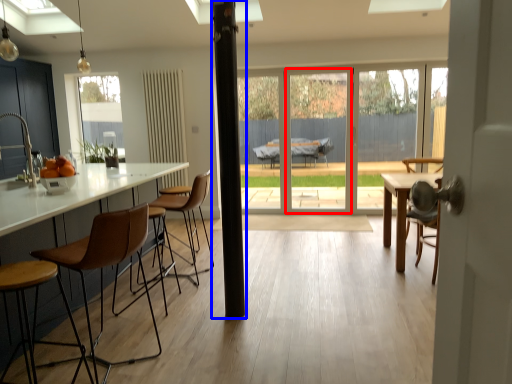
Question: Which of the following is the farthest to the observer, screen door (highlighted by a red box) or pillar (highlighted by a blue box)?

Choices:
 (A) screen door
 (B) pillar

Answer: (A)